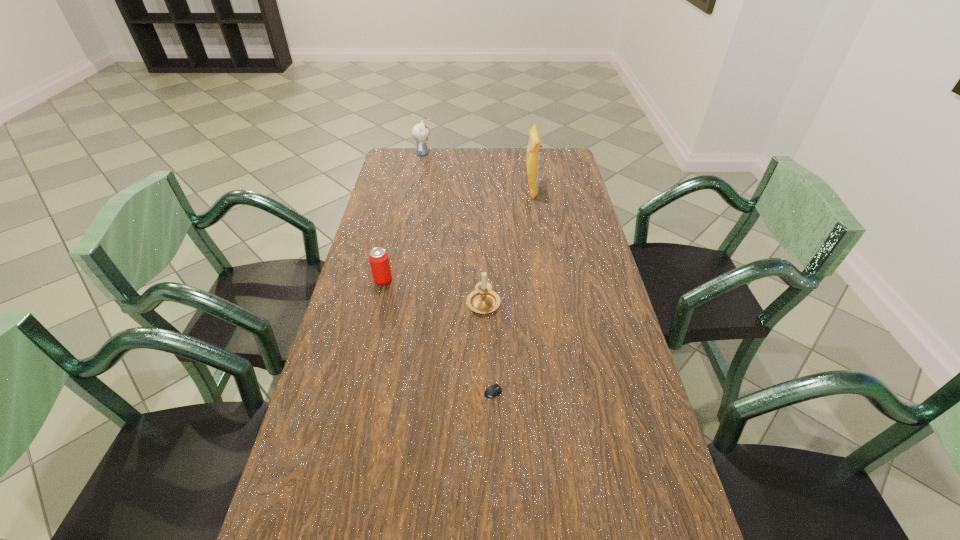
Locate an element on the screen. This screenshot has width=960, height=540. blank space located 0.160m on the front-facing side of the farthest object is located at coordinates (468, 153).

What are the coordinates of `vacant area situated with a handle on the side of the candle holder` in the screenshot? It's located at (483, 261).

This screenshot has width=960, height=540. I want to click on free point located 0.090m with a handle on the side of the candle holder, so click(483, 267).

Locate an element on the screen. Image resolution: width=960 pixels, height=540 pixels. free space located 0.050m with a handle on the side of the candle holder is located at coordinates (483, 276).

Where is `free space located on the back of the beer can`? This screenshot has width=960, height=540. free space located on the back of the beer can is located at coordinates (398, 214).

At what (x,y) coordinates should I click in order to perform the action: click on vacant space located 0.150m on the front of the nearest object. Please return your answer as a coordinate pair (x, y). Looking at the image, I should click on (508, 461).

Where is `object at the far edge`? The width and height of the screenshot is (960, 540). object at the far edge is located at coordinates (420, 132).

Locate an element on the screen. The image size is (960, 540). kitten that is at the left edge is located at coordinates (420, 132).

Where is `beer can that is at the left edge`? The height and width of the screenshot is (540, 960). beer can that is at the left edge is located at coordinates (379, 261).

Locate an element on the screen. object that is at the right edge is located at coordinates (534, 150).